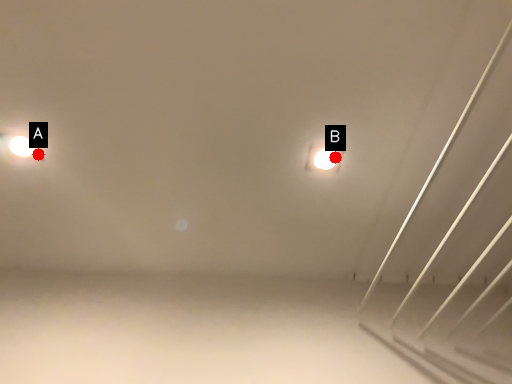
Question: Two points are circled on the image, labeled by A and B beside each circle. Among these points, which one is farthest from the camera?

Choices:
 (A) A is further
 (B) B is further

Answer: (A)